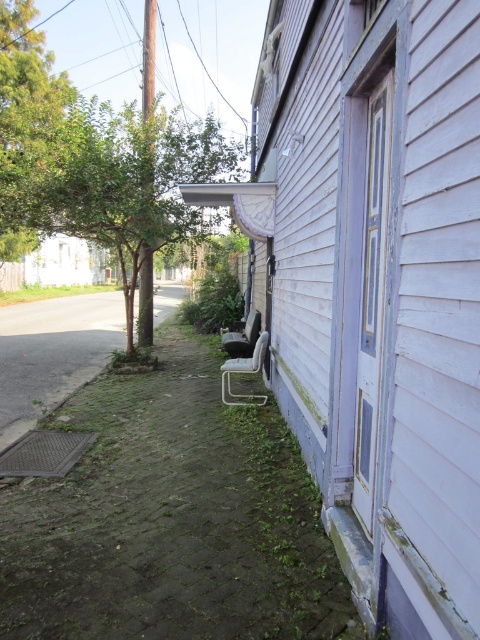
Question: Observing the image, what is the correct spatial positioning of metallic silver chair at lower center in reference to metallic gray chair at lower center?

Choices:
 (A) above
 (B) below

Answer: (B)

Question: Among these points, which one is nearest to the camera?

Choices:
 (A) (227, 403)
 (B) (254, 316)

Answer: (A)

Question: Which object is positioned farthest from the metallic silver chair at lower center?

Choices:
 (A) green leafy tree at left
 (B) metallic gray chair at lower center

Answer: (A)

Question: Is the position of green leafy tree at left less distant than that of metallic gray chair at lower center?

Choices:
 (A) yes
 (B) no

Answer: (A)

Question: Which point is farther to the camera?

Choices:
 (A) metallic silver chair at lower center
 (B) green leafy tree at upper left

Answer: (B)

Question: Is green leafy tree at upper left thinner than metallic silver chair at lower center?

Choices:
 (A) no
 (B) yes

Answer: (A)